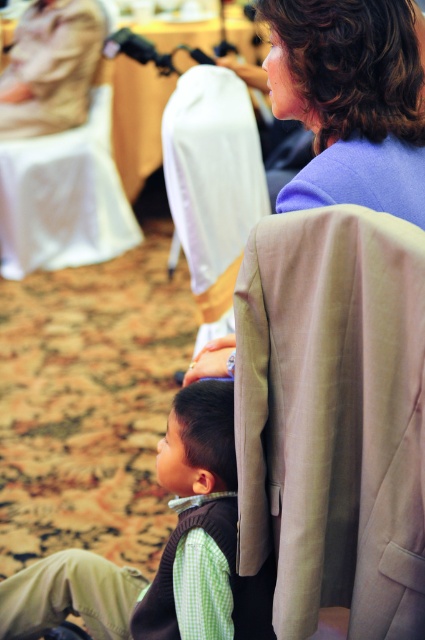
You are at a conference and need to move from the white fabric chair at upper left to the tan fabric chair at center. Which direction should you move to reach it?

The tan fabric chair at center is located below the white fabric chair at upper left, so you should move downward to reach it.

You are standing in the conference room and see the green checkered shirt at lower left. Can you determine its exact position in the room using coordinates?

The green checkered shirt at lower left is located at point (164, 548).

You are organizing a coat rack for guests at this event. You have two items to hang on the rack. The light brown woolen blazer at center and the green checkered shirt at lower left. Which item should you hang first if you want to use the least amount of space on the rack?

The light brown woolen blazer at center is thinner than the green checkered shirt at lower left, so it requires less space. Therefore, you should hang the green checkered shirt at lower left first to utilize the least amount of space on the rack.